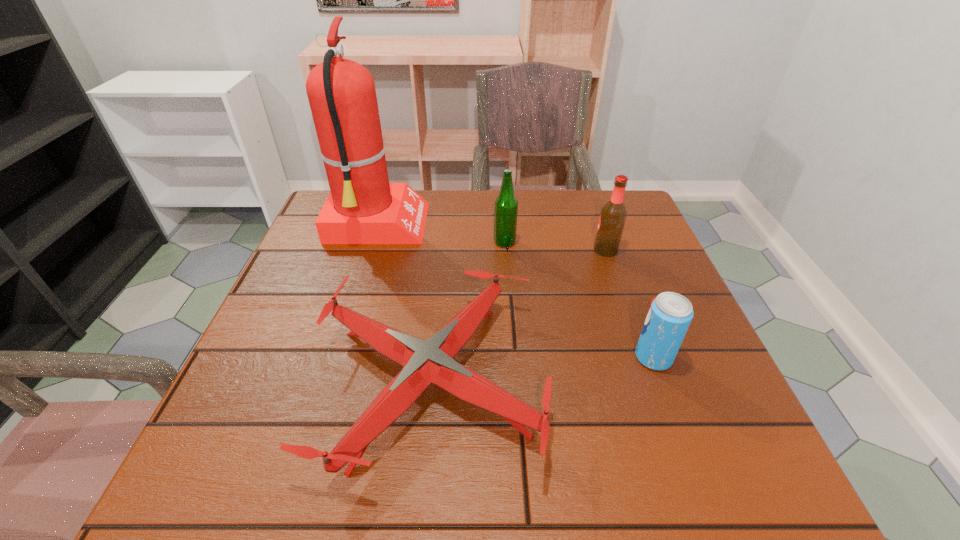
Locate an element on the screen. The image size is (960, 540). vacant position in the image that satisfies the following two spatial constraints: 1. on the front-facing side of the right beer bottle; 2. on the right side of the fire extinguisher is located at coordinates (370, 251).

The height and width of the screenshot is (540, 960). Identify the location of vacant space that satisfies the following two spatial constraints: 1. on the label of the left beer bottle; 2. on the front side of the shortest object. (515, 380).

Identify the location of vacant space that satisfies the following two spatial constraints: 1. on the front-facing side of the right beer bottle; 2. on the right side of the fire extinguisher. click(x=370, y=251).

Locate an element on the screen. The width and height of the screenshot is (960, 540). vacant area that satisfies the following two spatial constraints: 1. on the label of the left beer bottle; 2. on the left side of the soda can is located at coordinates click(513, 357).

Identify the location of vacant area in the image that satisfies the following two spatial constraints: 1. on the front side of the soda can; 2. on the left side of the right beer bottle. (643, 357).

This screenshot has width=960, height=540. Identify the location of vacant point that satisfies the following two spatial constraints: 1. on the back side of the right beer bottle; 2. on the label of the left beer bottle. point(603,242).

At what (x,y) coordinates should I click in order to perform the action: click on vacant space that satisfies the following two spatial constraints: 1. on the front-facing side of the tallest object; 2. on the right side of the right beer bottle. Please return your answer as a coordinate pair (x, y). Image resolution: width=960 pixels, height=540 pixels. Looking at the image, I should click on (370, 251).